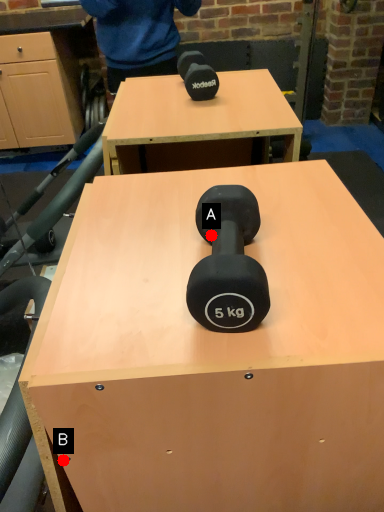
Question: Two points are circled on the image, labeled by A and B beside each circle. Which point is closer to the camera?

Choices:
 (A) A is closer
 (B) B is closer

Answer: (B)